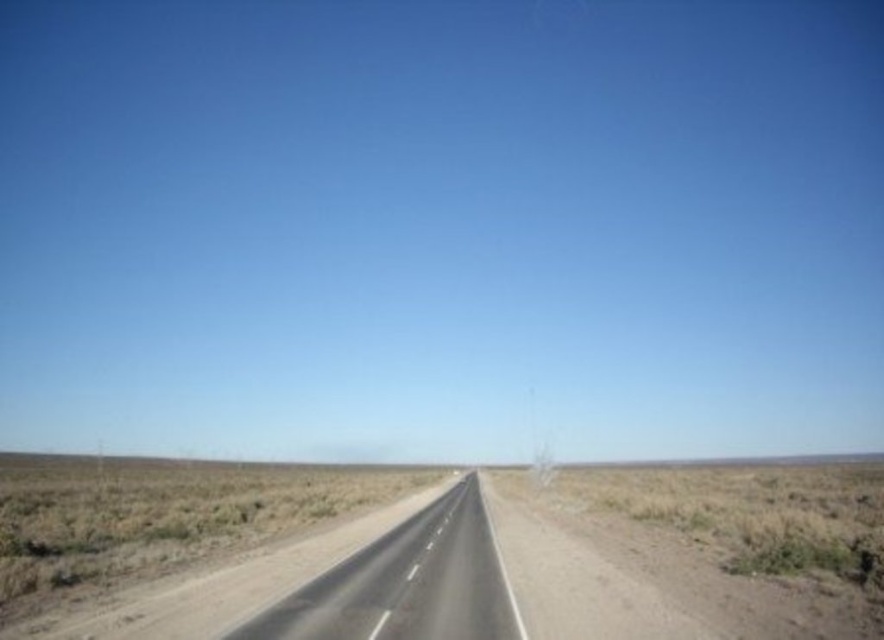
Based on the photo, can you confirm if smooth asphalt highway at center is wider than brown dirt at center?

No.

Between smooth asphalt highway at center and brown dirt at center, which one is positioned higher?

smooth asphalt highway at center

Who is more distant from viewer, (473,580) or (657,464)?

The point (657,464) is more distant.

The image size is (884, 640). Identify the location of smooth asphalt highway at center. (406, 582).